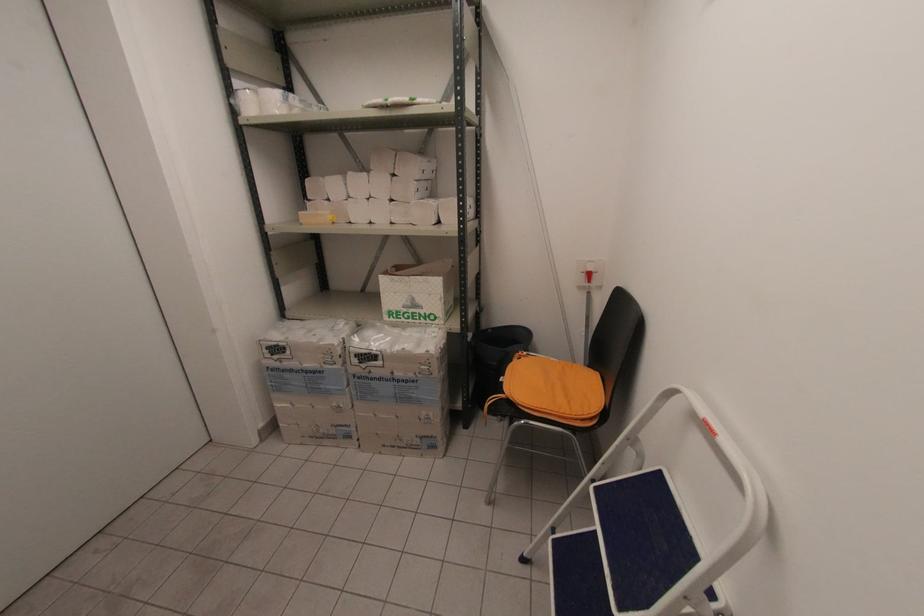
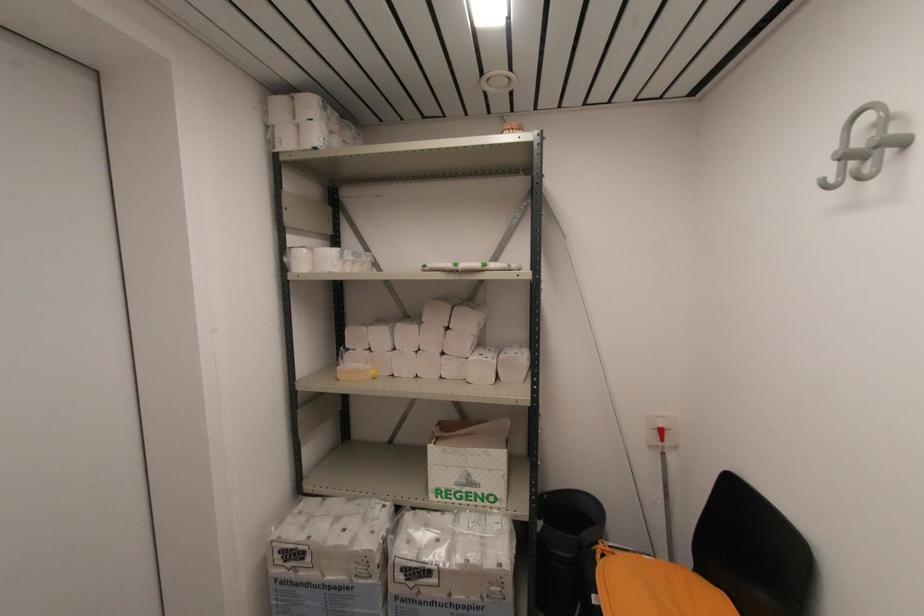
Where in the second image is the point corresponding to pixel 302 225 from the first image?

(339, 381)